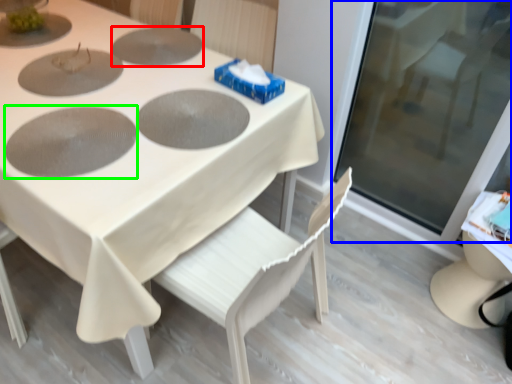
Question: Which is nearer to the pizza pan (highlighted by a red box)? glass door (highlighted by a blue box) or pizza pan (highlighted by a green box).

Choices:
 (A) glass door
 (B) pizza pan

Answer: (B)